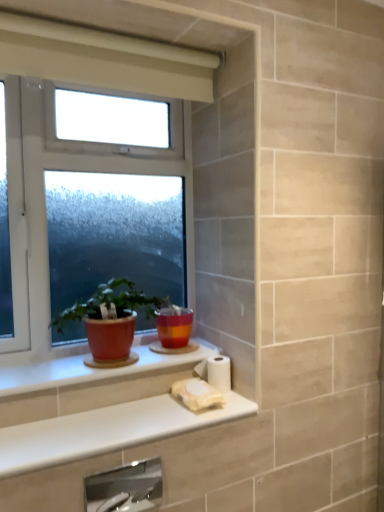
The image size is (384, 512). What do you see at coordinates (215, 372) in the screenshot?
I see `white matte toilet paper at lower center, which is the second toilet paper from bottom to top` at bounding box center [215, 372].

Locate an element on the screen. The image size is (384, 512). matte ceramic flowerpot at center is located at coordinates (174, 327).

Identify the location of white glossy counter top at lower center. The height and width of the screenshot is (512, 384). pos(107,430).

Where is `matte ceramic pot at window`? Image resolution: width=384 pixels, height=512 pixels. matte ceramic pot at window is located at coordinates (110, 318).

The height and width of the screenshot is (512, 384). What do you see at coordinates (110, 318) in the screenshot?
I see `matte ceramic pot at window` at bounding box center [110, 318].

This screenshot has width=384, height=512. What do you see at coordinates (196, 394) in the screenshot?
I see `white matte toilet paper at lower center, the 2th toilet paper in the top-to-bottom sequence` at bounding box center [196, 394].

Identify the location of satin nickel faucet at lower center. The height and width of the screenshot is (512, 384). (124, 487).

How different are the orientations of white glossy counter top at lower center and white matte toilet paper at lower center, which is the first toilet paper from top to bottom, in degrees?

1.3 degrees separate the facing orientations of white glossy counter top at lower center and white matte toilet paper at lower center, which is the first toilet paper from top to bottom.

Consider the image. Based on their positions, is white glossy counter top at lower center located to the left or right of white matte toilet paper at lower center, which is the second toilet paper from bottom to top?

Clearly, white glossy counter top at lower center is on the left of white matte toilet paper at lower center, which is the second toilet paper from bottom to top, in the image.

Which is correct: white glossy counter top at lower center is inside white matte toilet paper at lower center, which is the first toilet paper from top to bottom, or outside of it?

white glossy counter top at lower center is not inside white matte toilet paper at lower center, which is the first toilet paper from top to bottom, it's outside.

Considering the sizes of objects white matte toilet paper at lower center, which is the first toilet paper from top to bottom, and satin nickel faucet at lower center in the image provided, who is shorter, white matte toilet paper at lower center, which is the first toilet paper from top to bottom, or satin nickel faucet at lower center?

white matte toilet paper at lower center, which is the first toilet paper from top to bottom.

Which is behind, white matte toilet paper at lower center, which is the second toilet paper from bottom to top, or satin nickel faucet at lower center?

white matte toilet paper at lower center, which is the second toilet paper from bottom to top.

Are white matte toilet paper at lower center, which is the first toilet paper from top to bottom, and satin nickel faucet at lower center far apart?

Actually, white matte toilet paper at lower center, which is the first toilet paper from top to bottom, and satin nickel faucet at lower center are a little close together.

Looking at this image, considering the relative sizes of white glossy counter top at lower center and matte ceramic pot at window in the image provided, is white glossy counter top at lower center smaller than matte ceramic pot at window?

Yes, white glossy counter top at lower center is smaller than matte ceramic pot at window.

Is white glossy counter top at lower center not close to matte ceramic pot at window?

No, white glossy counter top at lower center is in close proximity to matte ceramic pot at window.

You are a GUI agent. You are given a task and a screenshot of the screen. Output one action in this format:
    pyautogui.click(x=<x>, y=<y>)
    Task: Click on the houseplant on the left of white glossy counter top at lower center
    
    Given the screenshot: What is the action you would take?
    pyautogui.click(x=110, y=318)

From the image's perspective, which one is positioned lower, white glossy counter top at lower center or matte ceramic pot at window?

white glossy counter top at lower center, from the image's perspective.

Is white glossy counter top at lower center located outside satin nickel faucet at lower center?

Indeed, white glossy counter top at lower center is completely outside satin nickel faucet at lower center.

Can you see white glossy counter top at lower center touching satin nickel faucet at lower center?

No, white glossy counter top at lower center is not touching satin nickel faucet at lower center.

Considering the sizes of objects white glossy counter top at lower center and satin nickel faucet at lower center in the image provided, who is wider, white glossy counter top at lower center or satin nickel faucet at lower center?

white glossy counter top at lower center.

Which object is positioned more to the left, white glossy counter top at lower center or satin nickel faucet at lower center?

satin nickel faucet at lower center is more to the left.

Are matte ceramic flowerpot at center and white matte toilet paper at lower center, the 2th toilet paper in the top-to-bottom sequence, far apart?

No, matte ceramic flowerpot at center is not far from white matte toilet paper at lower center, the 2th toilet paper in the top-to-bottom sequence.

Does point (169, 344) appear closer or farther from the camera than point (195, 397)?

Point (169, 344) is farther from the camera than point (195, 397).

How far apart are matte ceramic flowerpot at center and white matte toilet paper at lower center, the 2th toilet paper in the top-to-bottom sequence?

They are 20.20 centimeters apart.

Identify the location of toilet paper that is the 1st object to the right of the matte ceramic flowerpot at center, starting at the anchor. The image size is (384, 512). (196, 394).

From the image's perspective, which is above, matte ceramic flowerpot at center or matte ceramic window sill at lower left?

matte ceramic flowerpot at center is shown above in the image.

Is matte ceramic window sill at lower left a part of matte ceramic flowerpot at center?

No, matte ceramic window sill at lower left is not a part of matte ceramic flowerpot at center.

Who is shorter, matte ceramic flowerpot at center or matte ceramic window sill at lower left?

matte ceramic window sill at lower left.

Which object is thinner, matte ceramic window sill at lower left or matte ceramic flowerpot at center?

matte ceramic flowerpot at center.

From a real-world perspective, is matte ceramic window sill at lower left below matte ceramic flowerpot at center?

Yes.

Find the location of a particular element. window sill in front of the matte ceramic flowerpot at center is located at coordinates (93, 371).

The image size is (384, 512). I want to click on the 2nd toilet paper behind the white glossy counter top at lower center, so coord(215,372).

Where is `faucet below the white matte toilet paper at lower center, which is the first toilet paper from top to bottom (from a real-world perspective)`? faucet below the white matte toilet paper at lower center, which is the first toilet paper from top to bottom (from a real-world perspective) is located at coordinates (124, 487).

Considering their positions, is satin nickel faucet at lower center positioned closer to matte ceramic pot at window than white glossy counter top at lower center?

white glossy counter top at lower center is positioned closer to the anchor matte ceramic pot at window.

Which object lies nearer to the anchor point matte ceramic window sill at lower left, satin nickel faucet at lower center or white matte toilet paper at lower center, which is the first toilet paper from top to bottom?

white matte toilet paper at lower center, which is the first toilet paper from top to bottom, lies closer to matte ceramic window sill at lower left than the other object.

Estimate the real-world distances between objects in this image. Which object is closer to satin nickel faucet at lower center, white glossy counter top at lower center or white matte toilet paper at lower center, the first toilet paper ordered from the bottom?

The object closer to satin nickel faucet at lower center is white glossy counter top at lower center.

Based on their spatial positions, is white matte toilet paper at lower center, which is the second toilet paper from bottom to top, or matte ceramic flowerpot at center closer to satin nickel faucet at lower center?

matte ceramic flowerpot at center is closer to satin nickel faucet at lower center.

When comparing their distances from matte ceramic flowerpot at center, does white glossy counter top at lower center or satin nickel faucet at lower center seem closer?

Among the two, white glossy counter top at lower center is located nearer to matte ceramic flowerpot at center.

Considering their positions, is white matte toilet paper at lower center, which is the first toilet paper from top to bottom, positioned closer to satin nickel faucet at lower center than white glossy counter top at lower center?

white glossy counter top at lower center lies closer to satin nickel faucet at lower center than the other object.

From the image, which object appears to be farther from matte ceramic window sill at lower left, white plastic window at center or white matte toilet paper at lower center, the 2th toilet paper in the top-to-bottom sequence?

white plastic window at center.

Based on their spatial positions, is white matte toilet paper at lower center, the 2th toilet paper in the top-to-bottom sequence, or matte ceramic pot at window further from satin nickel faucet at lower center?

matte ceramic pot at window.

Where is `window sill that lies between white plastic window at center and white matte toilet paper at lower center, which is the second toilet paper from bottom to top, from top to bottom`? window sill that lies between white plastic window at center and white matte toilet paper at lower center, which is the second toilet paper from bottom to top, from top to bottom is located at coordinates tap(93, 371).

Locate an element on the screen. window sill positioned between matte ceramic pot at window and matte ceramic flowerpot at center from near to far is located at coordinates (93, 371).

You are a GUI agent. You are given a task and a screenshot of the screen. Output one action in this format:
    pyautogui.click(x=<x>, y=<y>)
    Task: Click on the faucet positioned between white glossy counter top at lower center and white matte toilet paper at lower center, the 2th toilet paper in the top-to-bottom sequence, from near to far
    
    Given the screenshot: What is the action you would take?
    pyautogui.click(x=124, y=487)

The width and height of the screenshot is (384, 512). Identify the location of flowerpot between white plastic window at center and white matte toilet paper at lower center, which is the first toilet paper from top to bottom, in the vertical direction. (174, 327).